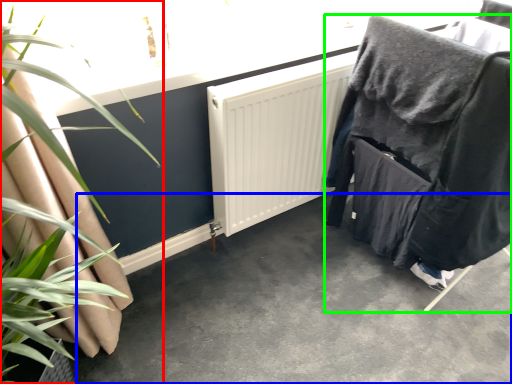
Question: Estimate the real-world distances between objects in this image. Which object is farther from houseplant (highlighted by a red box), concrete (highlighted by a blue box) or furniture (highlighted by a green box)?

Choices:
 (A) concrete
 (B) furniture

Answer: (B)